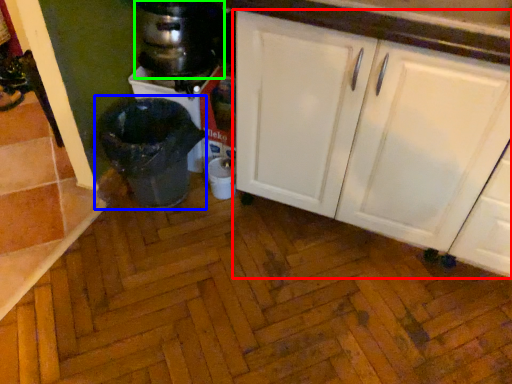
Question: Which object is positioned farthest from cabinetry (highlighted by a red box)? Select from waste container (highlighted by a blue box) and appliance (highlighted by a green box).

Choices:
 (A) waste container
 (B) appliance

Answer: (B)